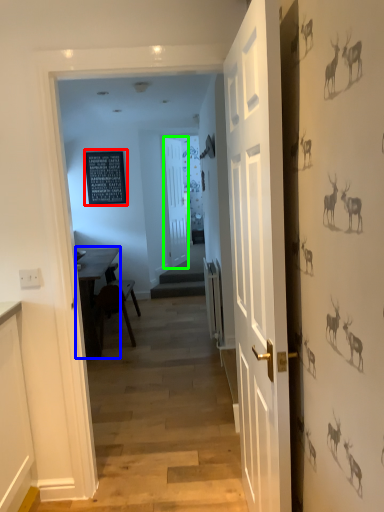
Question: Which object is the farthest from bulletin board (highlighted by a red box)? Choose among these: table (highlighted by a blue box) or door (highlighted by a green box).

Choices:
 (A) table
 (B) door

Answer: (A)